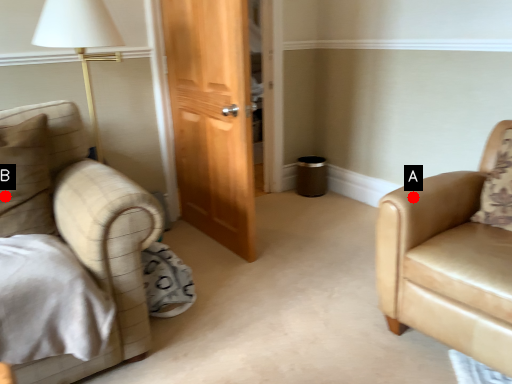
Question: Two points are circled on the image, labeled by A and B beside each circle. Which point appears closest to the camera in this image?

Choices:
 (A) A is closer
 (B) B is closer

Answer: (B)